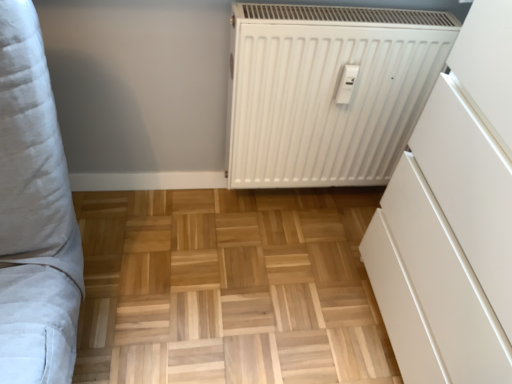
I want to click on vacant space situated above white matte radiator at center (from a real-world perspective), so pos(352,17).